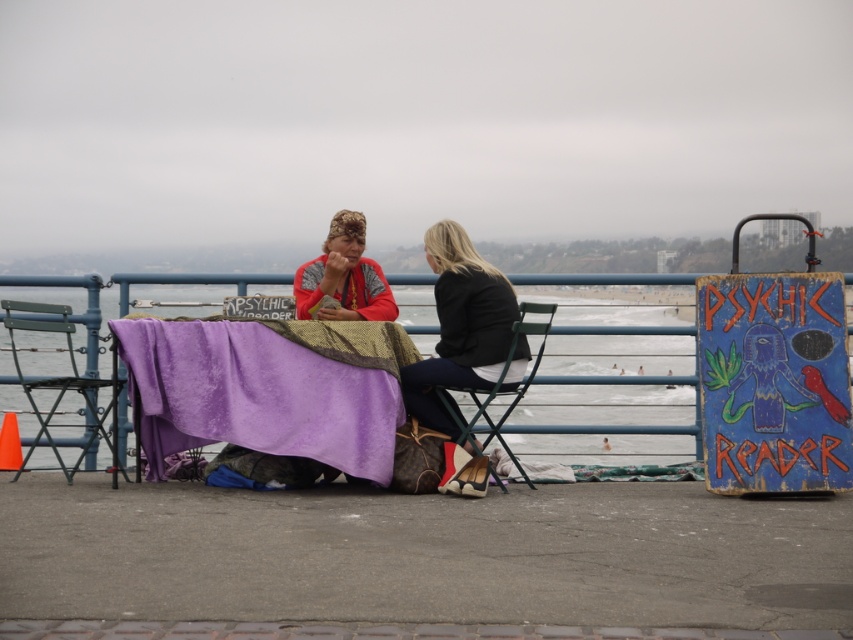
In the scene shown: You are standing at the edge of the pier and want to place a new bench exactly where the black leather jacket at center is currently located. Can you confirm the exact coordinates for placing the bench?

The exact coordinates for placing the bench where the black leather jacket at center is located are at point (460, 326).

You are planning to set up a small event at this seaside location and need to determine if the purple fabric table at center can accommodate a rectangular cake that requires a minimum of 1.2 meters in width. Given the metallic green chair at left is 0.5 meters wide, can the table fit the cake?

The purple fabric table at center might be wider than metallic green chair at left which is 0.5 meters wide. Since the table could potentially be wider than 0.5 meters, but the minimum required width for the cake is 1.2 meters, there is insufficient information to confirm if the table meets the requirement. Please verify the exact dimensions of the table.

You are standing at the point labeled as point (33, 308) and want to walk towards the point labeled as point (119, 342). Which direction should you move relative to your current position?

You should move forward because point (119, 342) is in front of point (33, 308).